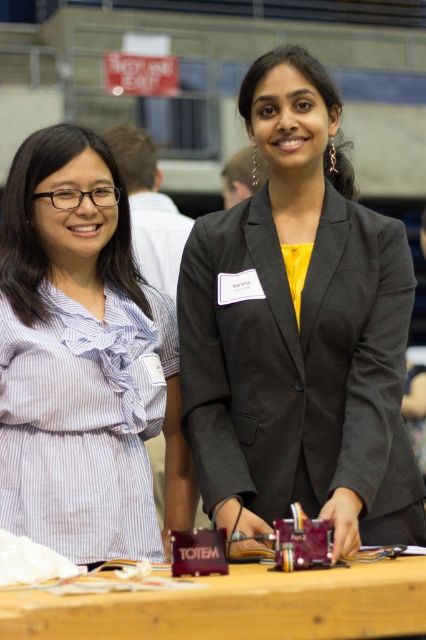
Looking at this image, can you confirm if white striped shirt at left is smaller than wooden table at center?

No, white striped shirt at left is not smaller than wooden table at center.

From the picture: Does white striped shirt at left have a greater width compared to wooden table at center?

No.

At what (x,y) coordinates should I click in order to perform the action: click on white striped shirt at left. Please return your answer as a coordinate pair (x, y). Image resolution: width=426 pixels, height=640 pixels. Looking at the image, I should click on (83, 360).

Does matte black blazer at center have a greater height compared to white striped shirt at left?

Yes.

How distant is matte black blazer at center from white striped shirt at left?

1.21 meters

Does point (313, 404) come closer to viewer compared to point (123, 364)?

Yes, point (313, 404) is in front of point (123, 364).

Locate an element on the screen. matte black blazer at center is located at coordinates (299, 332).

The height and width of the screenshot is (640, 426). What do you see at coordinates (299, 332) in the screenshot? I see `matte black blazer at center` at bounding box center [299, 332].

Where is `matte black blazer at center`? Image resolution: width=426 pixels, height=640 pixels. matte black blazer at center is located at coordinates (299, 332).

Which is in front, point (219, 406) or point (98, 580)?

Point (98, 580) is in front.

At what (x,y) coordinates should I click in order to perform the action: click on matte black blazer at center. Please return your answer as a coordinate pair (x, y). This screenshot has width=426, height=640. Looking at the image, I should click on (299, 332).